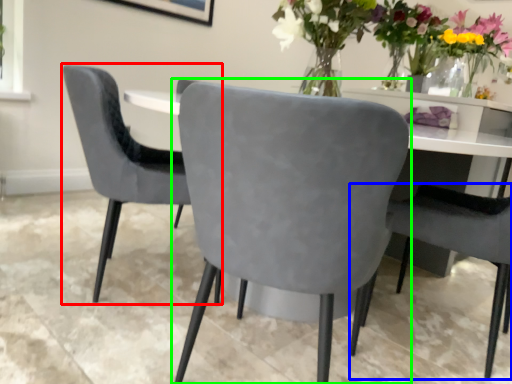
Question: Based on their relative distances, which object is farther from chair (highlighted by a red box)? Choose from chair (highlighted by a blue box) and chair (highlighted by a green box).

Choices:
 (A) chair
 (B) chair

Answer: (A)